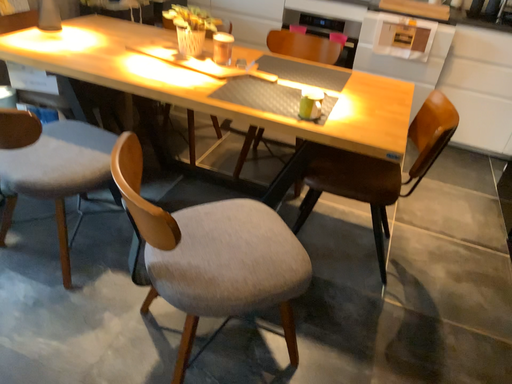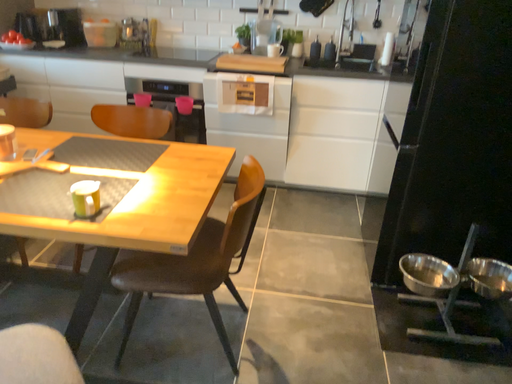
Question: Which way did the camera rotate in the video?

Choices:
 (A) rotated left
 (B) rotated right

Answer: (B)